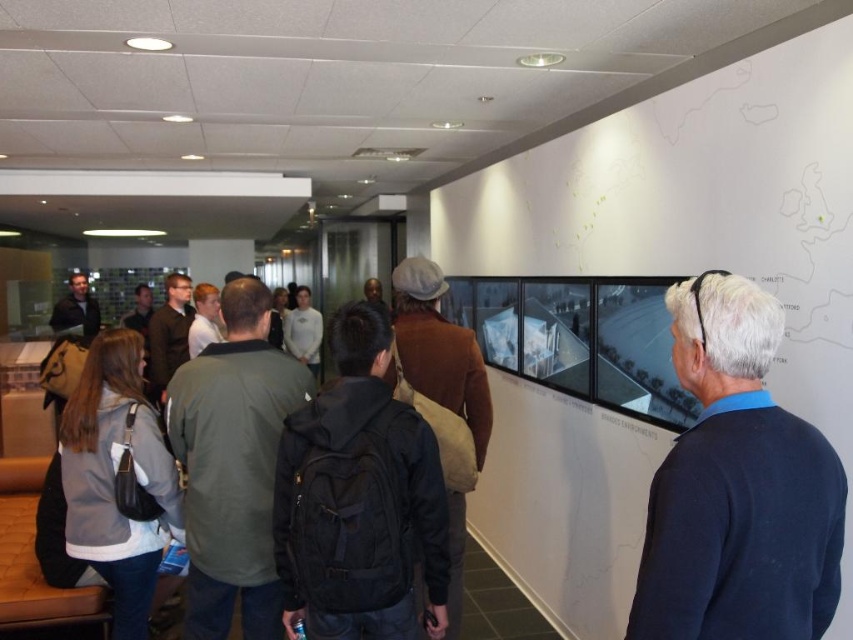
Question: Does dark blue sweater at center lie behind brown woolen coat at center?

Choices:
 (A) no
 (B) yes

Answer: (A)

Question: Which point is closer to the camera taking this photo?

Choices:
 (A) (483, 433)
 (B) (804, 566)

Answer: (B)

Question: Does dark blue sweater at center have a lesser width compared to brown woolen coat at center?

Choices:
 (A) no
 (B) yes

Answer: (A)

Question: Is dark blue sweater at center positioned at the back of brown woolen coat at center?

Choices:
 (A) no
 (B) yes

Answer: (A)

Question: Among these points, which one is nearest to the camera?

Choices:
 (A) (x=824, y=445)
 (B) (x=436, y=374)

Answer: (A)